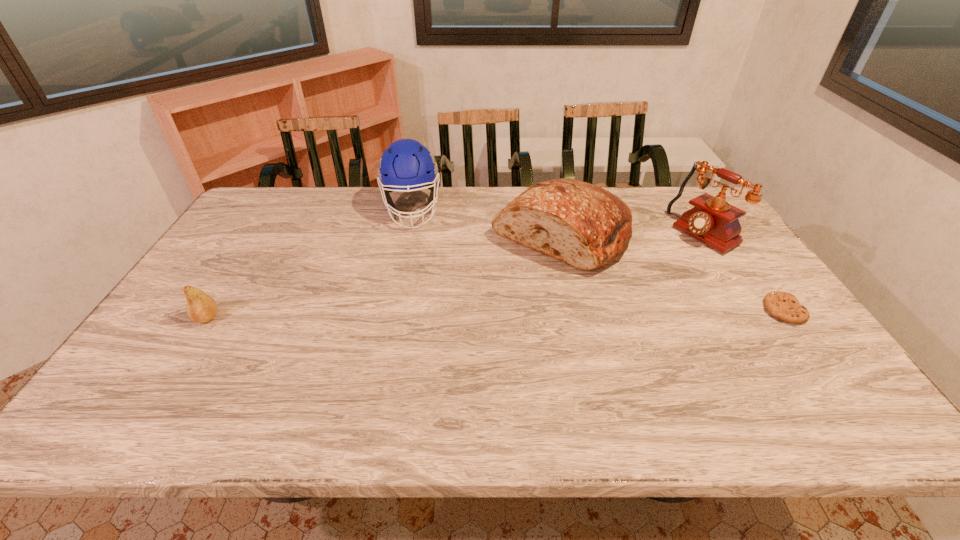
Find the location of `the leftmost object`. the leftmost object is located at coordinates (201, 308).

Locate an element on the screen. The image size is (960, 540). pear is located at coordinates 201,308.

At what (x,y) coordinates should I click in order to perform the action: click on the shortest object. Please return your answer as a coordinate pair (x, y). Image resolution: width=960 pixels, height=540 pixels. Looking at the image, I should click on (782, 305).

The image size is (960, 540). Find the location of `bread`. bread is located at coordinates (585, 226).

This screenshot has height=540, width=960. I want to click on the third object from right to left, so click(x=585, y=226).

Identify the location of football helmet. (406, 164).

Find the location of a particular element. This screenshot has height=540, width=960. telephone is located at coordinates (713, 221).

Where is `free space located 0.060m on the left of the pear`? The image size is (960, 540). free space located 0.060m on the left of the pear is located at coordinates click(171, 318).

Image resolution: width=960 pixels, height=540 pixels. What are the coordinates of `blank space located on the left of the cookie` in the screenshot? It's located at (718, 310).

At what (x,y) coordinates should I click in order to perform the action: click on vacant area situated 0.250m at the sliced front of the third tallest object. Please return your answer as a coordinate pair (x, y). Image resolution: width=960 pixels, height=540 pixels. Looking at the image, I should click on (458, 310).